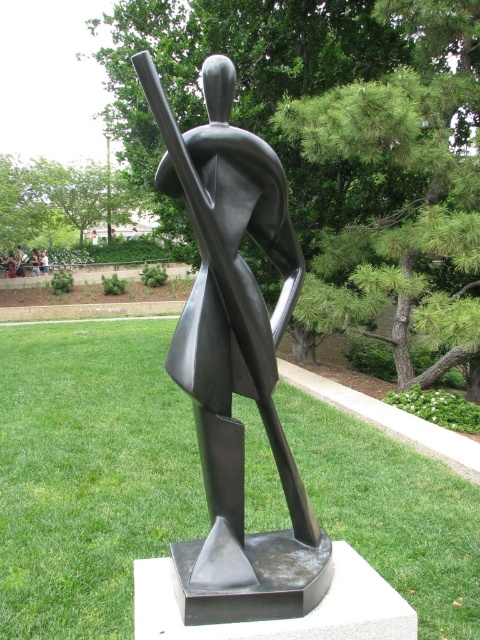
You are standing on the grassy area in front of the modern abstract sculpture. You see the metallic silver statue at center represented by point (36, 262). What is the coordinate of the metallic silver statue at center?

The coordinate of the metallic silver statue at center is point (36, 262).

You are standing at the point labeled point (35, 275). The sculpture is 25.56 meters away from you. If you want to take a photo of the sculpture, would you need to zoom in or out to capture the entire sculpture in the frame?

Since the sculpture is 25.56 meters away from you, you would need to zoom out to capture the entire sculpture in the frame.